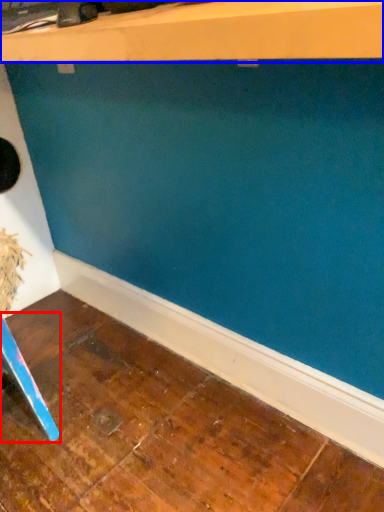
Question: Which of the following is the closest to the observer, furniture (highlighted by a red box) or shelf (highlighted by a blue box)?

Choices:
 (A) furniture
 (B) shelf

Answer: (B)